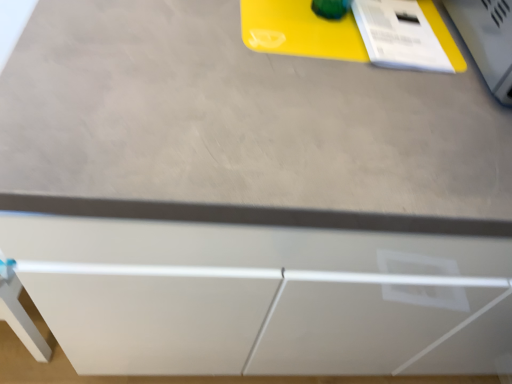
Identify the location of empty space that is ontop of matte gray countertop at center. Image resolution: width=512 pixels, height=384 pixels. (328, 67).